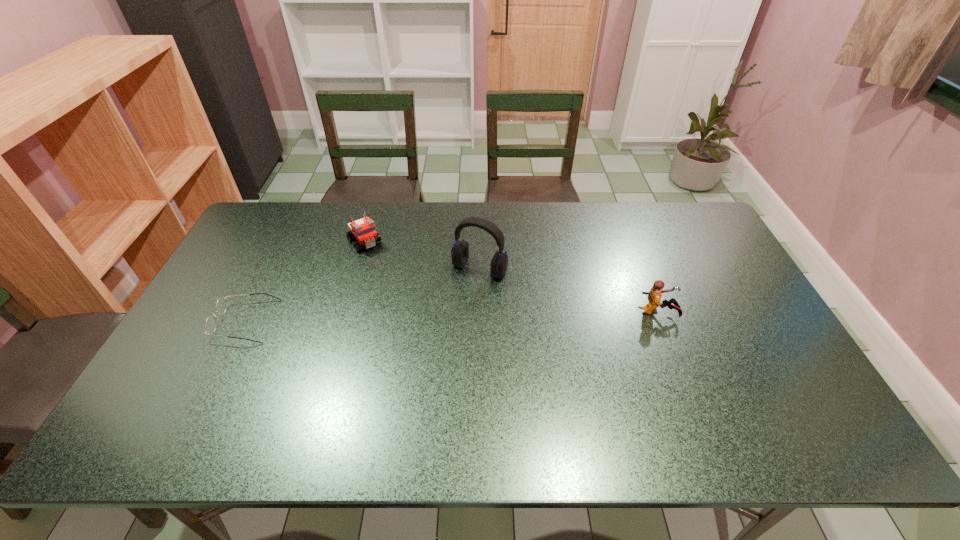
In the image, there is a desktop. At what (x,y) coordinates should I click in order to perform the action: click on vacant space at the far left corner. Please return your answer as a coordinate pair (x, y). Looking at the image, I should click on (268, 215).

Where is `vacant area that lies between the tallest object and the second object from left to right`? The image size is (960, 540). vacant area that lies between the tallest object and the second object from left to right is located at coordinates (422, 255).

Locate an element on the screen. Image resolution: width=960 pixels, height=540 pixels. vacant point located between the left Lego and the nearer Lego is located at coordinates (512, 277).

This screenshot has height=540, width=960. What are the coordinates of `vacant area between the farthest object and the shortest object` in the screenshot? It's located at (305, 281).

Find the location of a particular element. The image size is (960, 540). free spot between the rightmost object and the farther Lego is located at coordinates (512, 277).

You are a GUI agent. You are given a task and a screenshot of the screen. Output one action in this format:
    pyautogui.click(x=<x>, y=<y>)
    Task: Click on the free area in between the rightmost object and the shortest object
    
    Given the screenshot: What is the action you would take?
    pyautogui.click(x=453, y=316)

The image size is (960, 540). In order to click on vacant region between the rightmost object and the third nearest object in this screenshot , I will do `click(569, 291)`.

At what (x,y) coordinates should I click in order to perform the action: click on vacant area that lies between the tallest object and the spectacles. Please return your answer as a coordinate pair (x, y). This screenshot has height=540, width=960. Looking at the image, I should click on (x=363, y=295).

Locate an element on the screen. free space between the third object from right to left and the second farthest object is located at coordinates (422, 255).

Where is `vacant area that lies between the headset and the shortest object`? This screenshot has width=960, height=540. vacant area that lies between the headset and the shortest object is located at coordinates (363, 295).